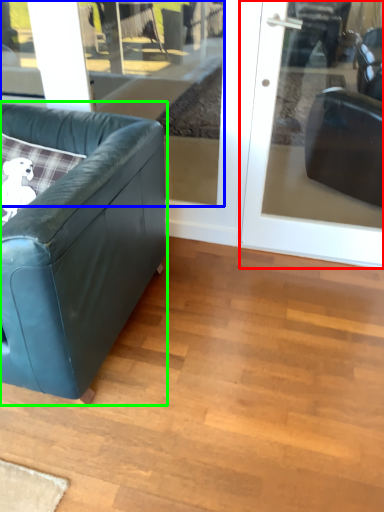
Question: Which object is positioned farthest from door (highlighted by a red box)? Select from window (highlighted by a blue box) and studio couch (highlighted by a green box).

Choices:
 (A) window
 (B) studio couch

Answer: (A)